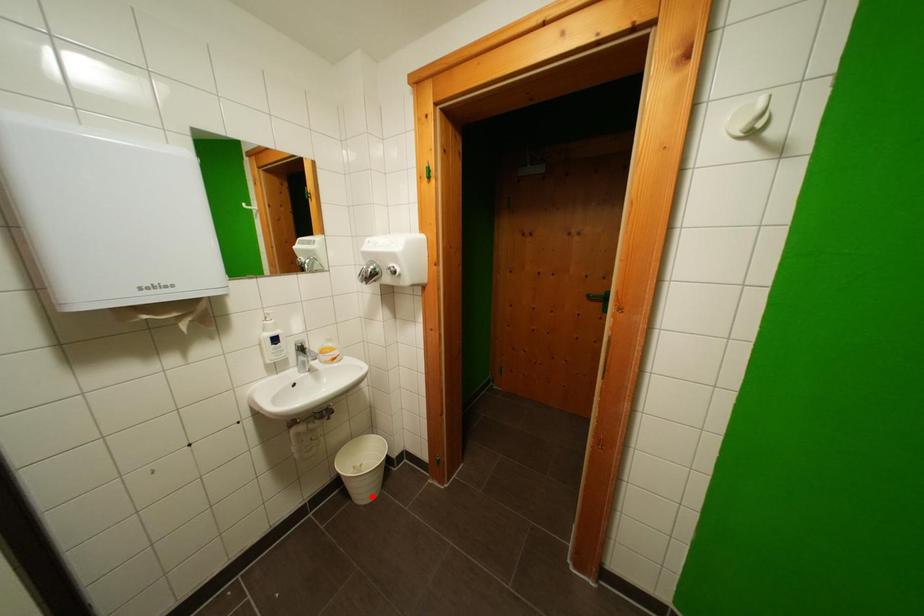
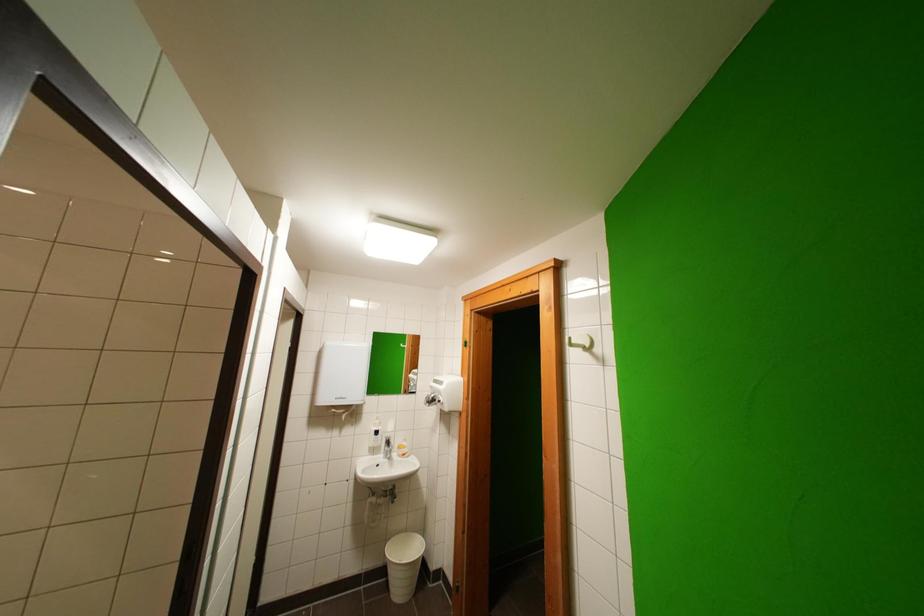
In the second image, find the point that corresponds to the highlighted location in the first image.

(406, 593)